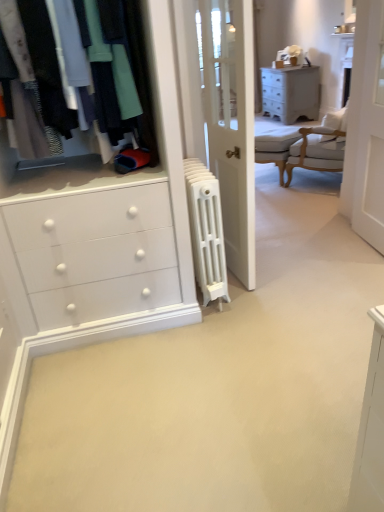
The width and height of the screenshot is (384, 512). I want to click on vacant space in between white wood screen door at upper right and white cast iron radiator at center, so (303, 266).